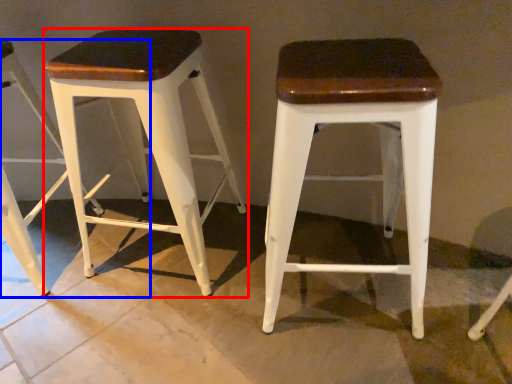
Question: Which point is further to the camera, stool (highlighted by a red box) or stool (highlighted by a blue box)?

Choices:
 (A) stool
 (B) stool

Answer: (B)